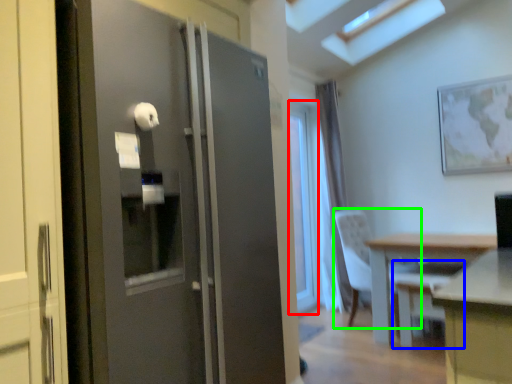
Question: Considering the real-world distances, which object is farthest from window (highlighted by a red box)? swivel chair (highlighted by a blue box) or chair (highlighted by a green box)?

Choices:
 (A) swivel chair
 (B) chair

Answer: (A)